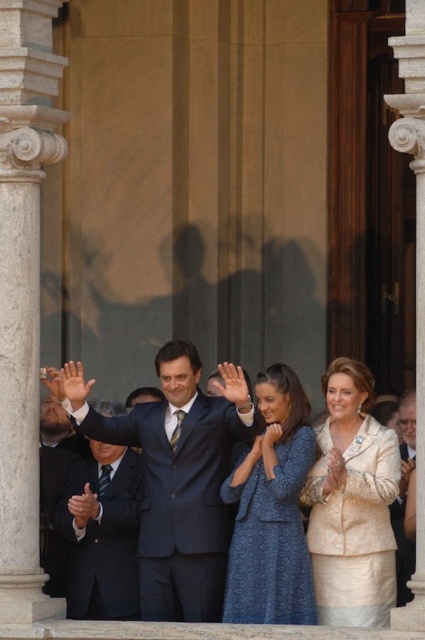
Between point (283, 552) and point (141, 483), which one is positioned behind?

Positioned behind is point (141, 483).

Can you confirm if blue textured dress at center is positioned below matte black suit at center?

Indeed, blue textured dress at center is positioned under matte black suit at center.

You are a GUI agent. You are given a task and a screenshot of the screen. Output one action in this format:
    pyautogui.click(x=<x>, y=<y>)
    Task: Click on the blue textured dress at center
    
    Given the screenshot: What is the action you would take?
    point(271,540)

At what (x,y) coordinates should I click in order to perform the action: click on blue textured dress at center. Please return your answer as a coordinate pair (x, y). This screenshot has height=640, width=425. Looking at the image, I should click on (271, 540).

Does blue textured dress at center have a lesser width compared to white marble pillar at right?

Correct, blue textured dress at center's width is less than white marble pillar at right's.

Based on the photo, can you confirm if blue textured dress at center is positioned above white marble pillar at right?

No.

At what (x,y) coordinates should I click in order to perform the action: click on blue textured dress at center. Please return your answer as a coordinate pair (x, y). The width and height of the screenshot is (425, 640). Looking at the image, I should click on (271, 540).

Can you confirm if dark blue pinstripe suit at center is positioned above matte black hand at center?

No.

Is point (104, 426) behind point (74, 374)?

Yes, it is.

Find the location of a particular element. This screenshot has height=640, width=425. dark blue pinstripe suit at center is located at coordinates (181, 481).

Identify the location of dark blue pinstripe suit at center. (181, 481).